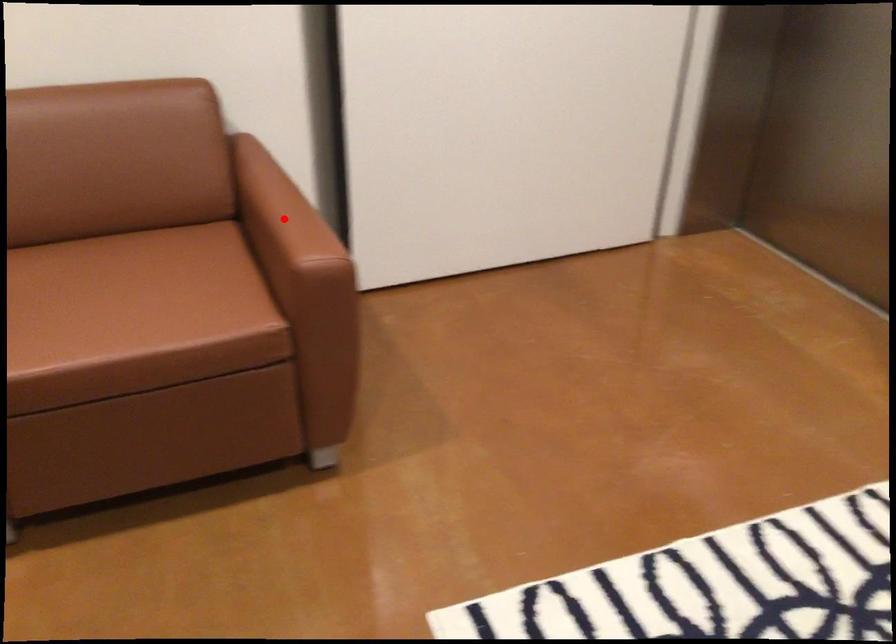
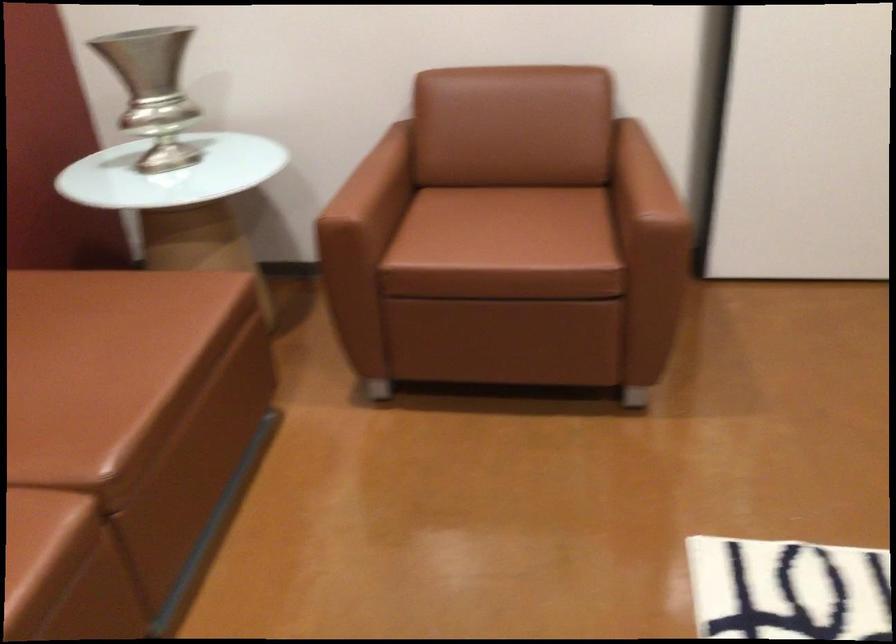
Question: I am providing you with two images of the same scene from different viewpoints. Image1 has a red point marked. In image2, the corresponding 3D location appears at what relative position? Reply with the corresponding letter.

Choices:
 (A) Closer
 (B) Farther

Answer: (B)